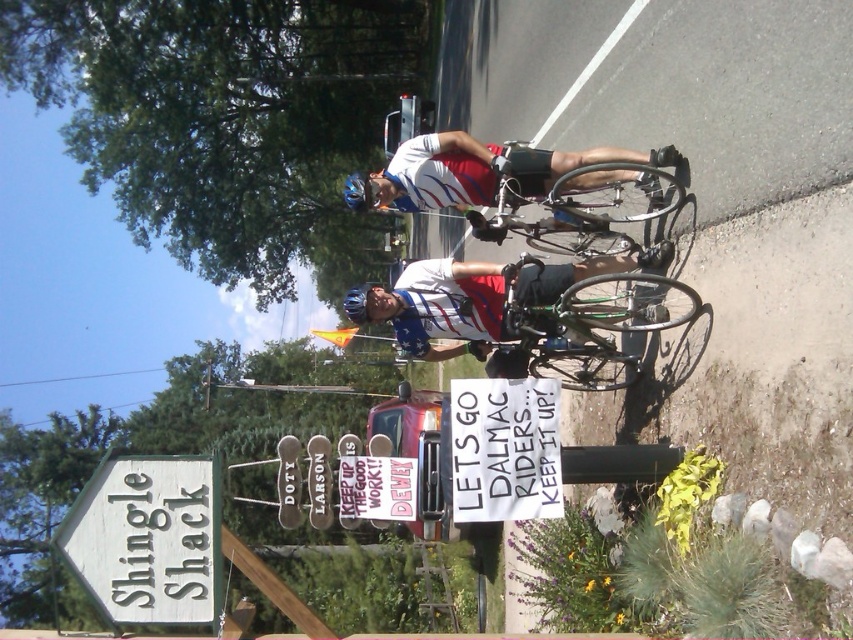
Question: Is shiny metallic bicycle at center above white wooden sign at lower left?

Choices:
 (A) yes
 (B) no

Answer: (A)

Question: Does white paper sign at center appear over matte blue helmet at center?

Choices:
 (A) yes
 (B) no

Answer: (B)

Question: Estimate the real-world distances between objects in this image. Which object is closer to the white wooden sign at lower left?

Choices:
 (A) matte white helmet at center
 (B) blue matte bicycle helmet at center
 (C) white paper sign at center
 (D) matte blue helmet at center

Answer: (C)

Question: Which of the following is the farthest from the observer?

Choices:
 (A) matte white helmet at center
 (B) shiny metallic bicycle at center
 (C) matte white and blue cycling jersey at center

Answer: (A)

Question: Is white wooden sign at lower left below white paper sign at center?

Choices:
 (A) yes
 (B) no

Answer: (A)

Question: Which point appears farthest from the camera in this image?

Choices:
 (A) (354, 193)
 (B) (610, 168)
 (C) (193, 493)

Answer: (A)